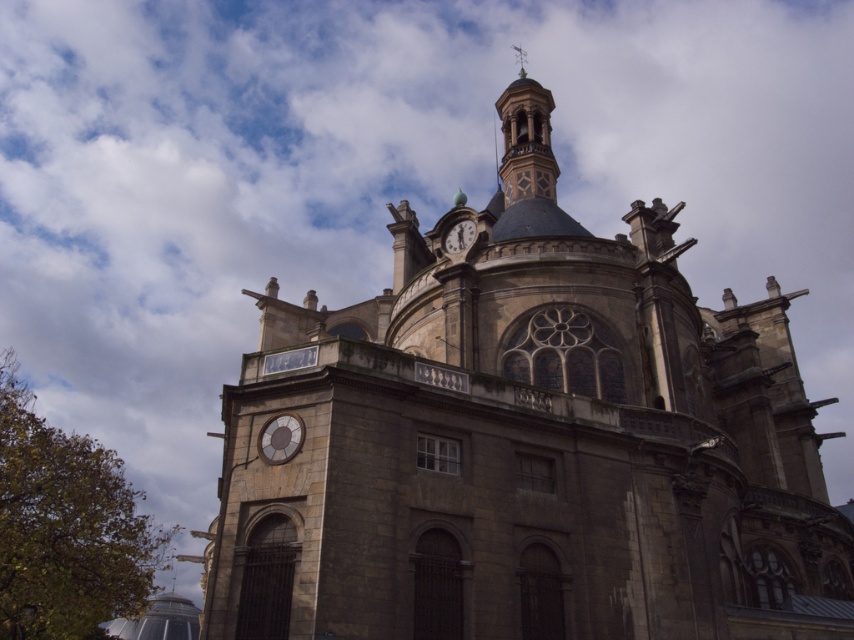
You are an architect designing a new garden layout around the stone church at center and the smooth stone clock tower at upper center. To ensure symmetry, you need to know which structure is wider. Which one is wider?

The stone church at center is wider than the smooth stone clock tower at upper center, so the garden layout should be designed to balance around its width.

You are standing in front of the historic building and want to determine which of the two points, point [512,170] or point [284,449], is closer to you. Based on the building details, which point is nearer?

Point [512,170] is closer to you because it is further to the viewer than point [284,449].

You are standing in front of the grand historic building. You notice the stone church at center and the smooth stone clock tower at upper center. Which of these two structures is positioned further to the left from your viewpoint?

The stone church at center is positioned to the left of the smooth stone clock tower at upper center, so it is further to the left from your viewpoint.